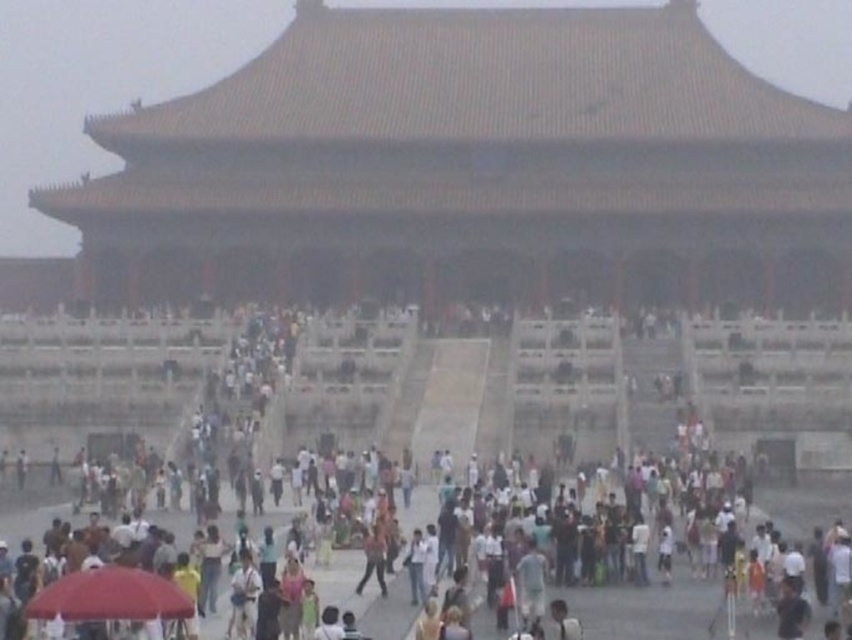
Question: Which of the following is the farthest from the observer?

Choices:
 (A) (55, 609)
 (B) (481, 385)

Answer: (B)

Question: Which of the following is the closest to the observer?

Choices:
 (A) multicolored casual attire at center
 (B) red fabric umbrella at lower left

Answer: (B)

Question: Where is multicolored casual attire at center located in relation to red fabric umbrella at lower left in the image?

Choices:
 (A) left
 (B) right

Answer: (B)

Question: Can you confirm if multicolored casual attire at center is thinner than red fabric umbrella at lower left?

Choices:
 (A) yes
 (B) no

Answer: (B)

Question: Is multicolored casual attire at center positioned before red fabric umbrella at lower left?

Choices:
 (A) yes
 (B) no

Answer: (B)